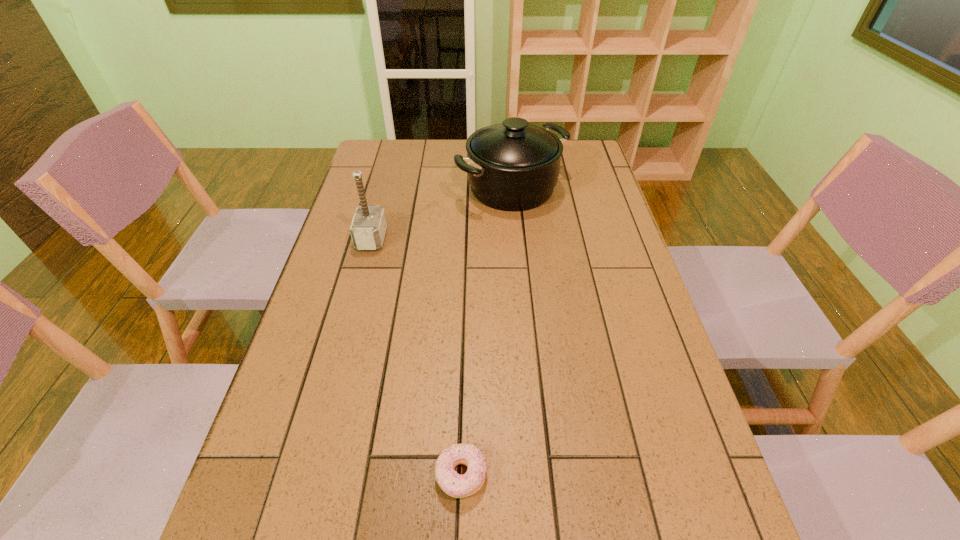
In order to click on the farthest object in this screenshot , I will do point(513,166).

Where is `the leftmost object`? Image resolution: width=960 pixels, height=540 pixels. the leftmost object is located at coordinates (368, 227).

What are the coordinates of `hammer` in the screenshot? It's located at (368, 227).

Where is `the shortest object`? The height and width of the screenshot is (540, 960). the shortest object is located at coordinates (455, 485).

The image size is (960, 540). I want to click on the nearest object, so click(455, 485).

The height and width of the screenshot is (540, 960). What are the coordinates of `vacant space located on the back of the farthest object` in the screenshot? It's located at (508, 148).

I want to click on free space located for striking with the head of the leftmost object, so click(x=447, y=239).

The height and width of the screenshot is (540, 960). Identify the location of vacant space located 0.110m on the left of the doughnut. (376, 475).

This screenshot has height=540, width=960. In order to click on object at the far edge in this screenshot , I will do `click(513, 166)`.

Identify the location of object at the left edge. (368, 227).